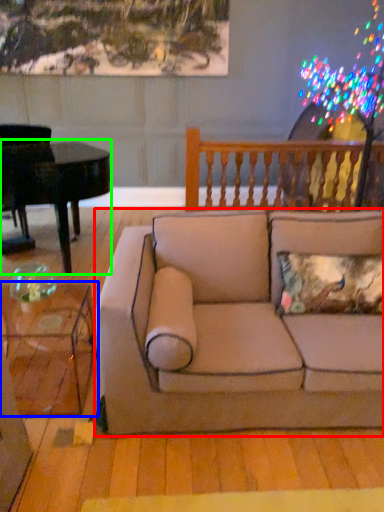
Question: Which is farther away from studio couch (highlighted by a red box)? coffee table (highlighted by a blue box) or piano (highlighted by a green box)?

Choices:
 (A) coffee table
 (B) piano

Answer: (B)